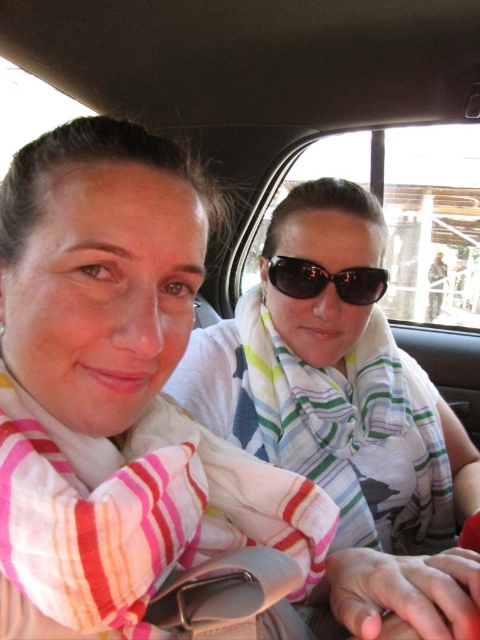
Question: Which of the following is the farthest from the observer?

Choices:
 (A) (363, 426)
 (B) (310, 269)

Answer: (A)

Question: Does white striped scarf at center lie in front of matte black sunglasses at center?

Choices:
 (A) yes
 (B) no

Answer: (A)

Question: Is the position of white striped scarf at center more distant than that of matte black sunglasses at center?

Choices:
 (A) no
 (B) yes

Answer: (A)

Question: Where is white striped scarf at center located in relation to matte black sunglasses at center in the image?

Choices:
 (A) below
 (B) above

Answer: (A)

Question: Which point appears farthest from the camera in this image?

Choices:
 (A) (300, 259)
 (B) (410, 413)

Answer: (B)